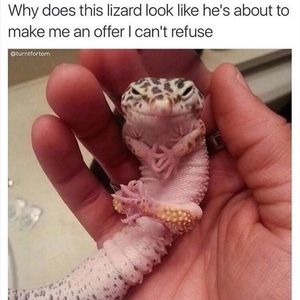
This screenshot has height=300, width=300. I want to click on right front leg, so click(139, 153).